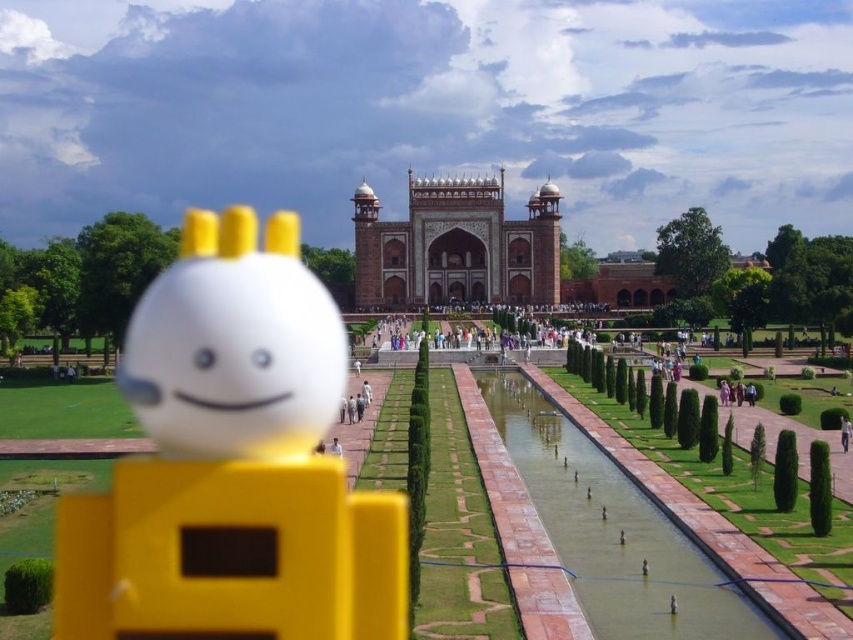
Question: Which of the following is the farthest from the observer?

Choices:
 (A) marble taj mahal at center
 (B) white matte face at center
 (C) yellow matte toy at center
 (D) white matte person at center

Answer: (A)

Question: Which point is closer to the camera taking this photo?

Choices:
 (A) (108, 637)
 (B) (850, 428)

Answer: (A)

Question: Does yellow matte toy at center appear over white matte face at center?

Choices:
 (A) yes
 (B) no

Answer: (B)

Question: Which object is closer to the camera taking this photo?

Choices:
 (A) yellow matte toy at center
 (B) white matte face at center

Answer: (A)

Question: Observing the image, what is the correct spatial positioning of yellow matte toy at center in reference to white matte person at center?

Choices:
 (A) right
 (B) left

Answer: (B)

Question: Is marble taj mahal at center positioned at the back of white matte person at center?

Choices:
 (A) yes
 (B) no

Answer: (A)